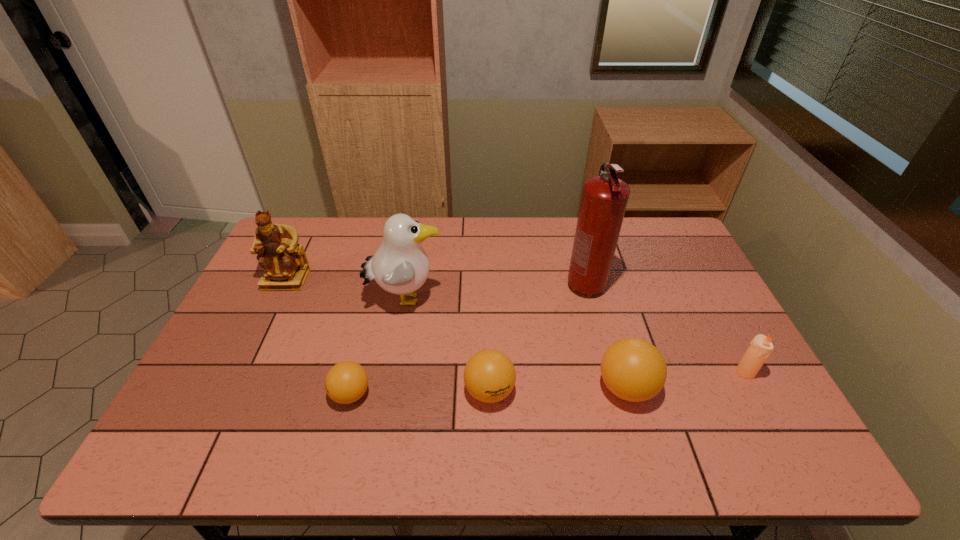
This screenshot has width=960, height=540. In the image, there is a desktop. Identify the location of vacant space at the far edge. (348, 218).

The width and height of the screenshot is (960, 540). Identify the location of free space at the near edge of the desktop. (610, 414).

Find the location of a particular element. vacant space at the left edge of the desktop is located at coordinates (208, 369).

Identify the location of vacant space at the right edge of the desktop. The height and width of the screenshot is (540, 960). (697, 312).

In the image, there is a desktop. At what (x,y) coordinates should I click in order to perform the action: click on free space at the far left corner. Please return your answer as a coordinate pair (x, y). The width and height of the screenshot is (960, 540). Looking at the image, I should click on (301, 218).

Find the location of a particular element. The image size is (960, 540). free space between the tallest ping-pong ball and the third tallest object is located at coordinates (456, 334).

Find the location of a particular element. The width and height of the screenshot is (960, 540). free space between the sixth tallest object and the gull is located at coordinates (447, 345).

This screenshot has height=540, width=960. What are the coordinates of `empty space that is in between the gull and the shortest ping-pong ball` in the screenshot? It's located at (378, 347).

At what (x,y) coordinates should I click in order to perform the action: click on free space between the candle and the rightmost ping-pong ball. Please return your answer as a coordinate pair (x, y). Looking at the image, I should click on (685, 380).

Find the location of a particular element. free spot between the leftmost ping-pong ball and the gull is located at coordinates (378, 347).